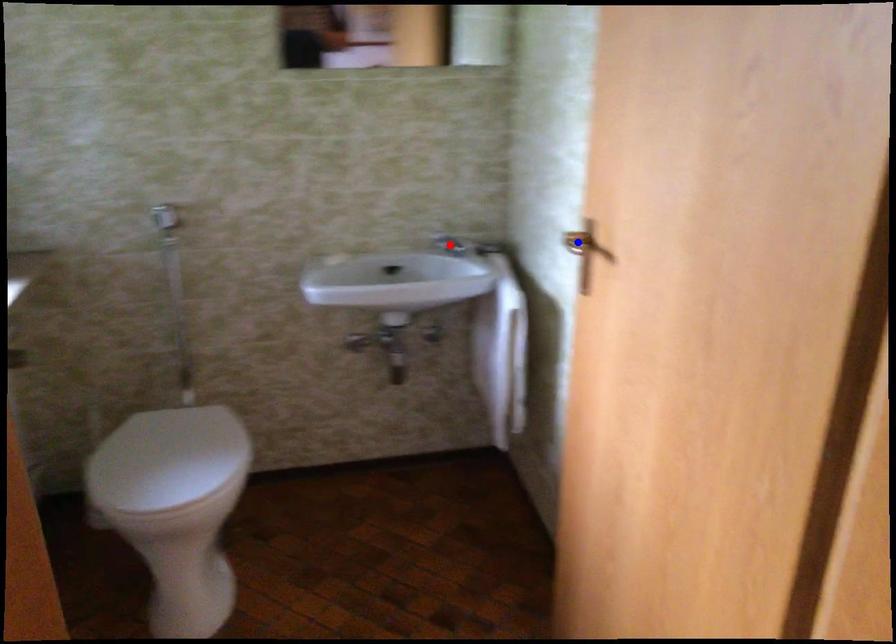
Question: In the image, two points are highlighted. Which point is nearer to the camera? Reply with the corresponding letter.

Choices:
 (A) blue point
 (B) red point

Answer: (A)